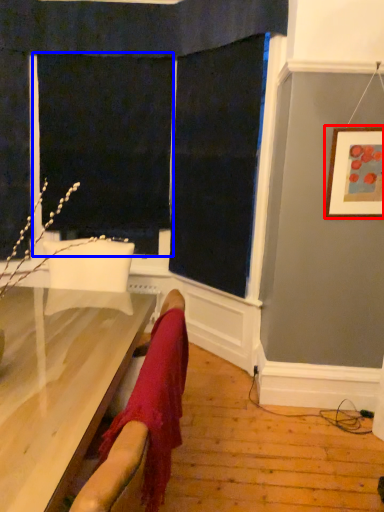
Question: Among these objects, which one is nearest to the camera, picture frame (highlighted by a red box) or screen door (highlighted by a blue box)?

Choices:
 (A) picture frame
 (B) screen door

Answer: (A)